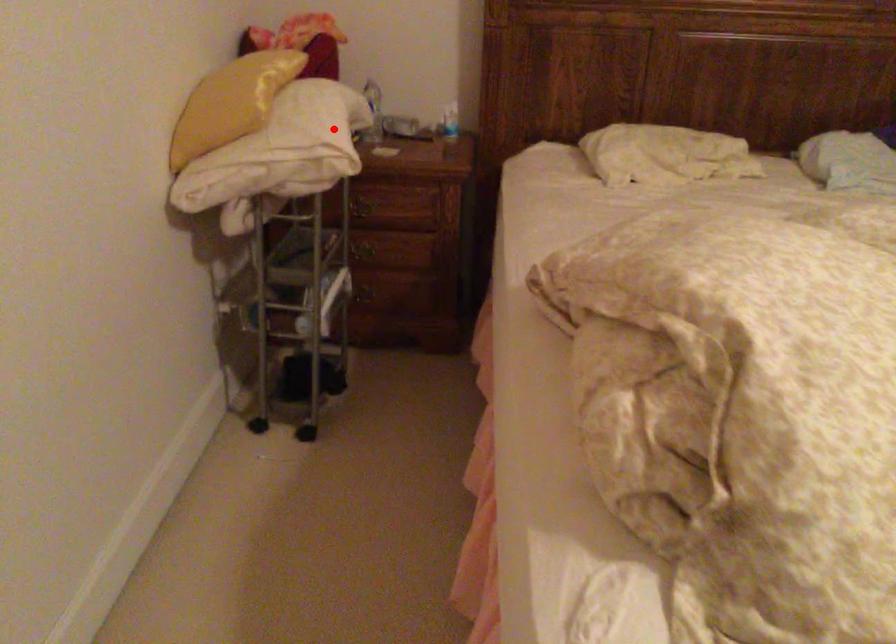
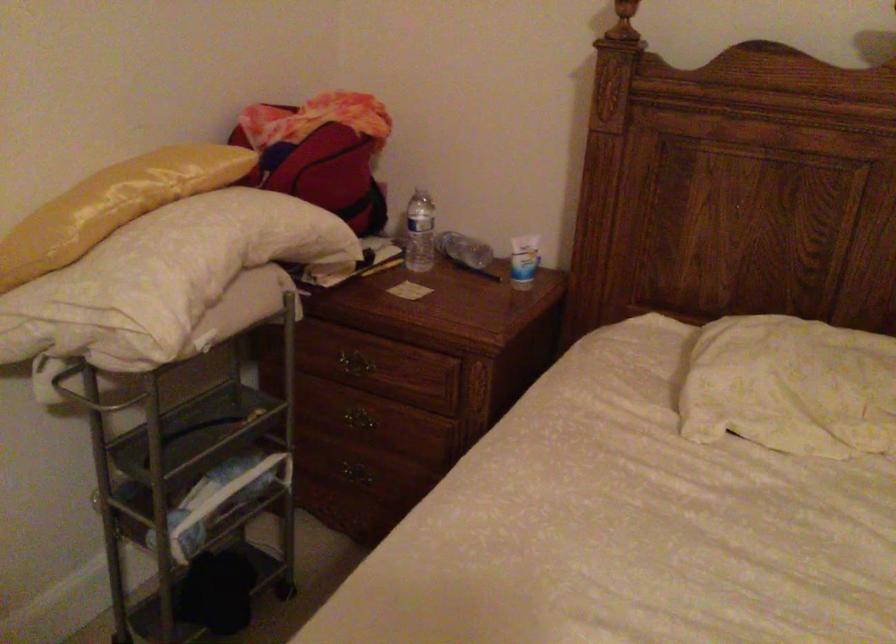
Find the pixel in the second image that matches the highlighted location in the first image.

(164, 278)